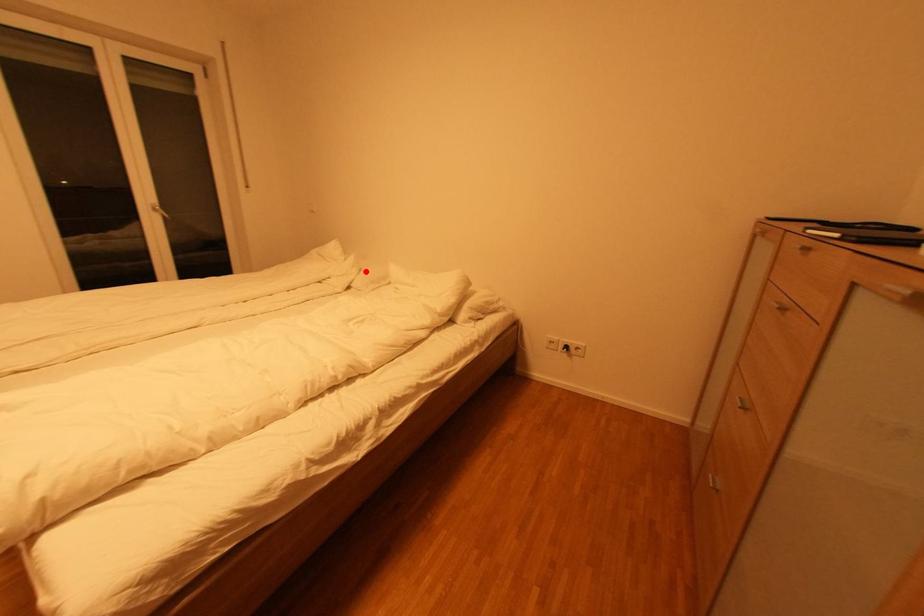
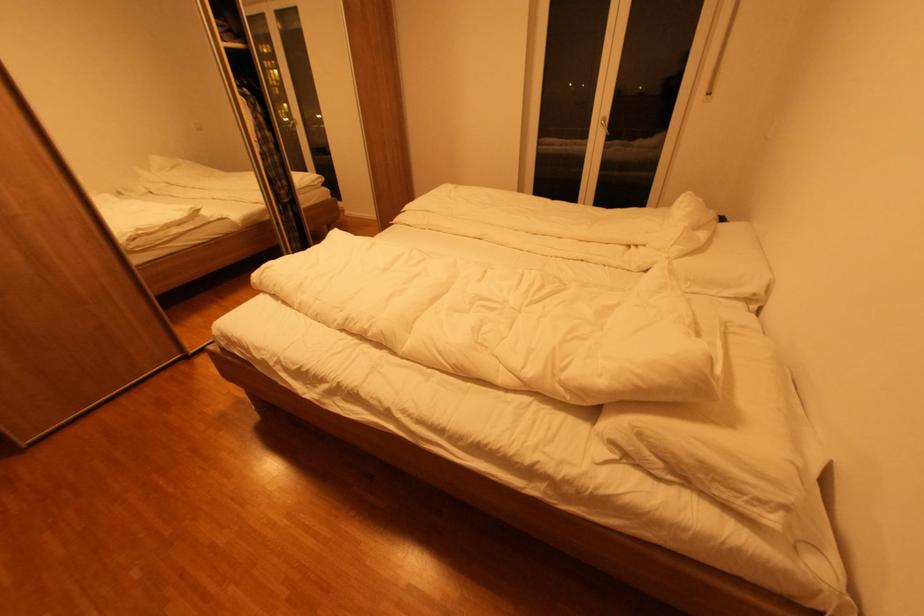
In the second image, find the point that corresponds to the highlighted location in the first image.

(697, 254)